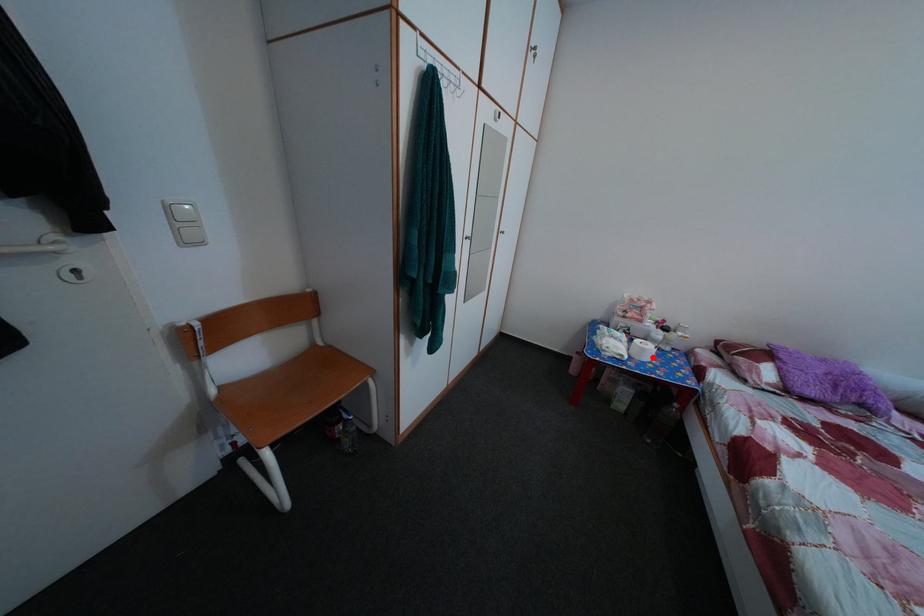
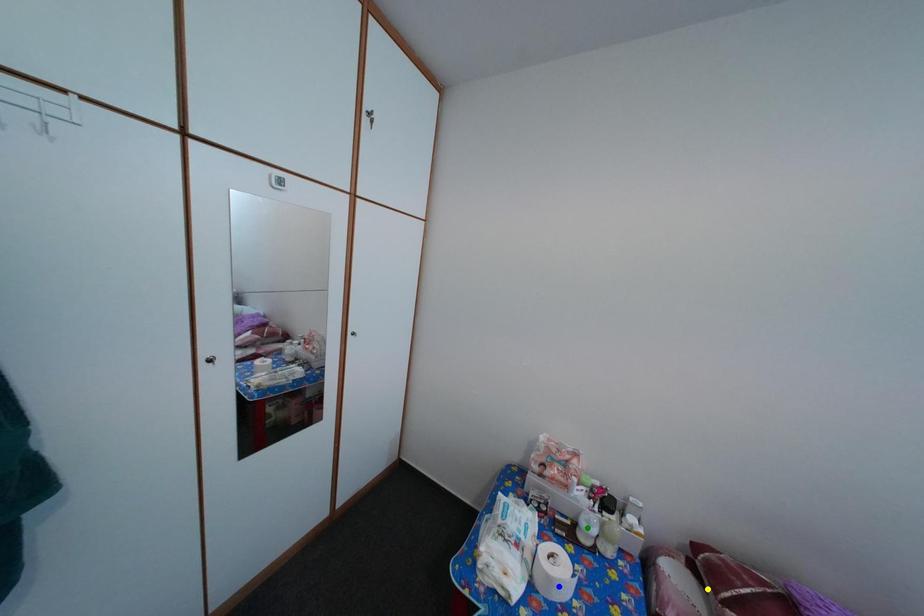
Question: I am providing you with two images of the same scene from different viewpoints. A red point is marked on the first image. You are given multiple points on the second image. Can you choose the point in image 2 that corresponds to the point in image 1?

Choices:
 (A) blue point
 (B) green point
 (C) yellow point

Answer: (A)